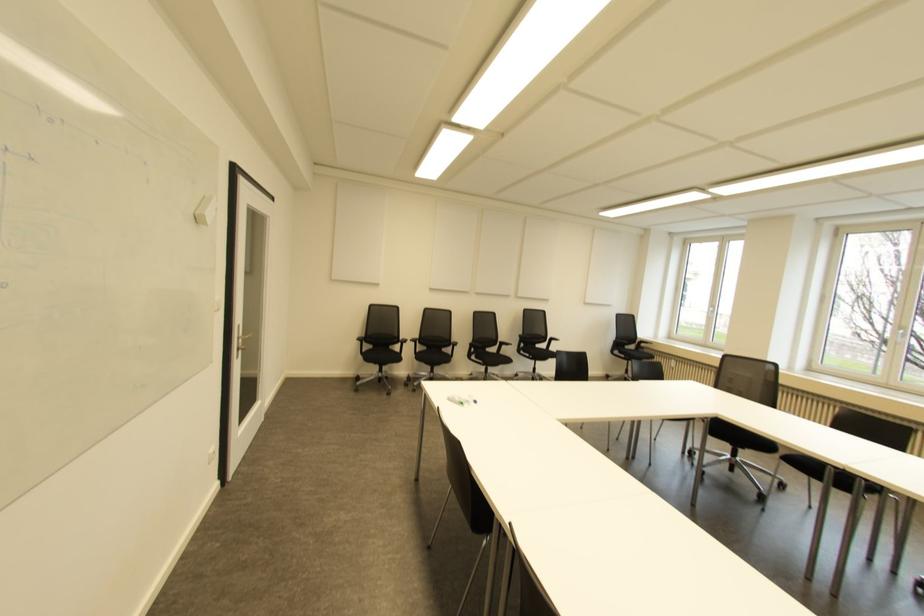
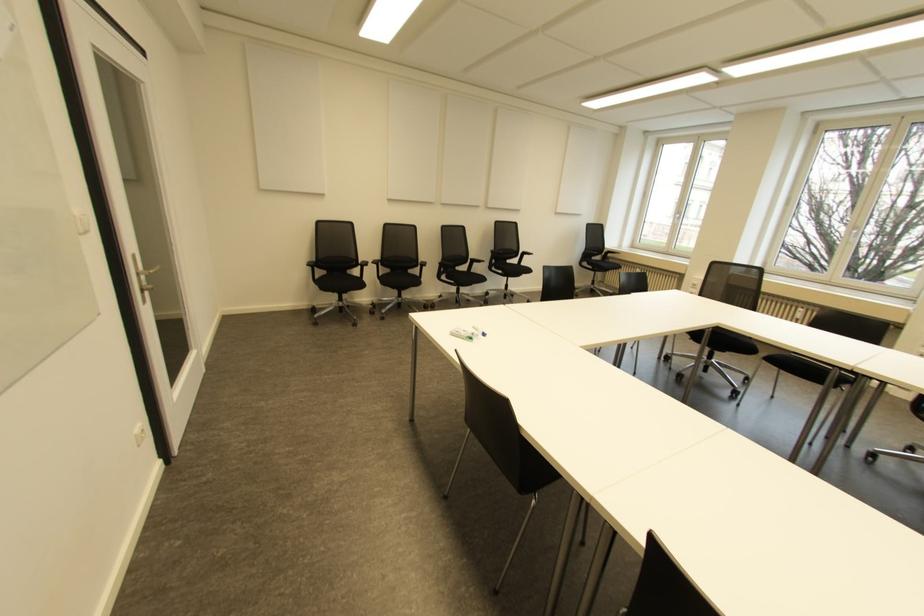
Find the pixel in the second image that matches pixel 462 403 in the first image.

(470, 338)